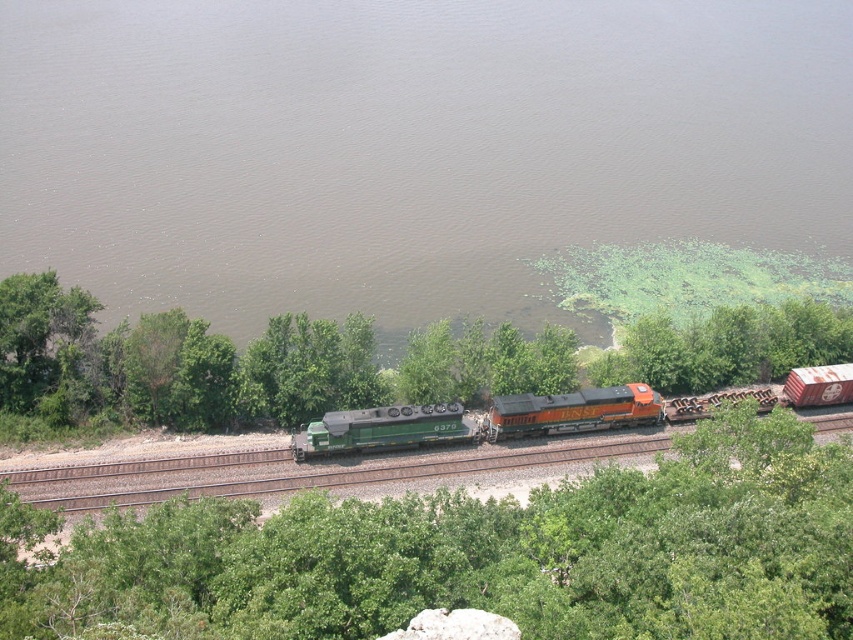
Who is shorter, orange glossy locomotive at center or green matte train car at center?

Standing shorter between the two is green matte train car at center.

Which is below, orange glossy locomotive at center or green matte train car at center?

green matte train car at center

Identify the location of orange glossy locomotive at center. Image resolution: width=853 pixels, height=640 pixels. (572, 412).

Which is above, brown murky water at upper center or green matte train at center?

Positioned higher is brown murky water at upper center.

Who is positioned more to the right, brown murky water at upper center or green matte train at center?

green matte train at center

Locate an element on the screen. brown murky water at upper center is located at coordinates (408, 147).

What are the coordinates of `brown murky water at upper center` in the screenshot? It's located at (408, 147).

Can you confirm if brown murky water at upper center is wider than green leafy tree at center?

Yes, brown murky water at upper center is wider than green leafy tree at center.

Who is more distant from viewer, [815,228] or [238,589]?

The point [815,228] is behind.

Where is `brown murky water at upper center`? The height and width of the screenshot is (640, 853). brown murky water at upper center is located at coordinates [408, 147].